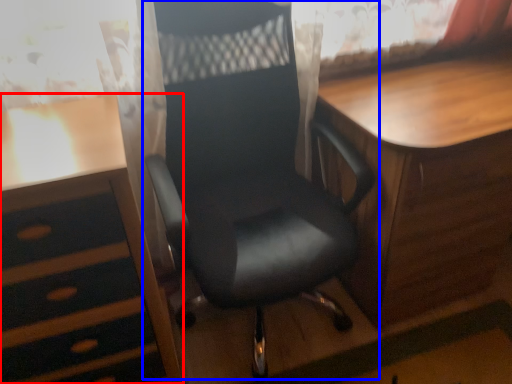
Question: Among these objects, which one is farthest to the camera, desk (highlighted by a red box) or chair (highlighted by a blue box)?

Choices:
 (A) desk
 (B) chair

Answer: (A)